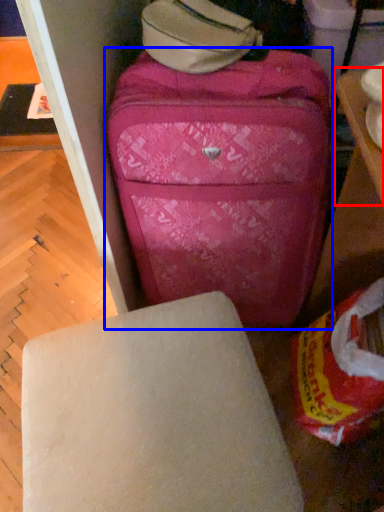
Question: Which object appears farthest to the camera in this image, table (highlighted by a red box) or suitcase (highlighted by a blue box)?

Choices:
 (A) table
 (B) suitcase

Answer: (B)